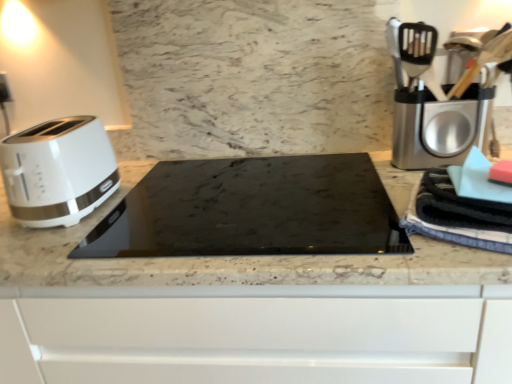
The width and height of the screenshot is (512, 384). Identify the location of black glass cooktop at center. (252, 210).

I want to click on blue striped towel at right, so click(x=462, y=207).

Which object is further away from the camera, blue striped towel at right or black glass cooktop at center?

Positioned behind is black glass cooktop at center.

Which is closer to the camera, [457,233] or [315,241]?

Point [457,233]

This screenshot has height=384, width=512. What are the coordinates of `blanket that is above the black glass cooktop at center (from the image's perspective)` in the screenshot? It's located at 462,207.

From the image's perspective, between blue striped towel at right and black glass cooktop at center, who is located below?

black glass cooktop at center is shown below in the image.

Is white glossy toaster at left behind marble at center?

Yes, it is.

Is point (106, 160) positioned before point (429, 355)?

No, (106, 160) is behind (429, 355).

Could you tell me if white glossy toaster at left is turned towards marble at center?

No, white glossy toaster at left does not turn towards marble at center.

Which of these two, white glossy toaster at left or marble at center, stands shorter?

white glossy toaster at left.

Considering the sizes of objects silver metallic coffee machine at right and marble at center in the image provided, who is thinner, silver metallic coffee machine at right or marble at center?

silver metallic coffee machine at right is thinner.

In the image, there is a marble at center. What are the coordinates of `coffee machine above it (from the image's perspective)` in the screenshot? It's located at (432, 105).

How distant is silver metallic coffee machine at right from marble at center?

The distance of silver metallic coffee machine at right from marble at center is 40.12 centimeters.

From the image's perspective, relative to marble at center, is silver metallic coffee machine at right above or below?

silver metallic coffee machine at right is above marble at center.

From a real-world perspective, is blue striped towel at right over silver metallic coffee machine at right?

No, from a real-world perspective, blue striped towel at right is not above silver metallic coffee machine at right.

From the image's perspective, between blue striped towel at right and silver metallic coffee machine at right, who is located below?

blue striped towel at right, from the image's perspective.

Considering the relative sizes of blue striped towel at right and silver metallic coffee machine at right in the image provided, is blue striped towel at right taller than silver metallic coffee machine at right?

Incorrect, the height of blue striped towel at right is not larger of that of silver metallic coffee machine at right.

Is point (496, 192) farther from viewer compared to point (430, 44)?

No, (496, 192) is closer to viewer.

Is there a large distance between silver metallic coffee machine at right and white glossy toaster at left?

That's not correct — silver metallic coffee machine at right is a little close to white glossy toaster at left.

Is point (443, 145) closer to camera compared to point (64, 139)?

No, it is not.

What are the coordinates of `toaster in front of the silver metallic coffee machine at right` in the screenshot? It's located at (58, 171).

Considering the sizes of objects silver metallic coffee machine at right and white glossy toaster at left in the image provided, who is wider, silver metallic coffee machine at right or white glossy toaster at left?

Wider between the two is white glossy toaster at left.

From the picture: Which of these two, marble at center or silver metallic coffee machine at right, is bigger?

Bigger between the two is marble at center.

From the image's perspective, which one is positioned higher, marble at center or silver metallic coffee machine at right?

silver metallic coffee machine at right is shown above in the image.

Relative to silver metallic coffee machine at right, is marble at center in front or behind?

Clearly, marble at center is in front of silver metallic coffee machine at right.

From a real-world perspective, is marble at center on silver metallic coffee machine at right?

No, from a real-world perspective, marble at center is not on top of silver metallic coffee machine at right.

Are blue striped towel at right and white glossy toaster at left making contact?

No, blue striped towel at right is not making contact with white glossy toaster at left.

From the image's perspective, is blue striped towel at right above white glossy toaster at left?

No, from the image's perspective, blue striped towel at right is not over white glossy toaster at left.

Who is taller, blue striped towel at right or white glossy toaster at left?

white glossy toaster at left is taller.

How distant is blue striped towel at right from white glossy toaster at left?

blue striped towel at right and white glossy toaster at left are 27.53 inches apart from each other.

Locate an element on the screen. Image resolution: width=512 pixels, height=384 pixels. blanket above the black glass cooktop at center (from a real-world perspective) is located at coordinates (462, 207).

This screenshot has width=512, height=384. Find the location of `toaster located on the left of marble at center`. toaster located on the left of marble at center is located at coordinates (58, 171).

Which object lies further to the anchor point silver metallic coffee machine at right, blue striped towel at right or white glossy toaster at left?

white glossy toaster at left is further to silver metallic coffee machine at right.

When comparing their distances from silver metallic coffee machine at right, does white glossy toaster at left or marble at center seem closer?

marble at center.

When comparing their distances from marble at center, does silver metallic coffee machine at right or black glass cooktop at center seem further?

Among the two, silver metallic coffee machine at right is located further to marble at center.

From the image, which object appears to be nearer to silver metallic coffee machine at right, marble at center or white glossy toaster at left?

Result: marble at center.

From the image, which object appears to be farther from white glossy toaster at left, black glass cooktop at center or marble at center?

marble at center is further to white glossy toaster at left.

From the picture: When comparing their distances from blue striped towel at right, does marble at center or silver metallic coffee machine at right seem further?

marble at center.

When comparing their distances from white glossy toaster at left, does marble at center or black glass cooktop at center seem closer?

black glass cooktop at center lies closer to white glossy toaster at left than the other object.

Estimate the real-world distances between objects in this image. Which object is closer to white glossy toaster at left, silver metallic coffee machine at right or black glass cooktop at center?

Based on the image, black glass cooktop at center appears to be nearer to white glossy toaster at left.

Locate an element on the screen. This screenshot has width=512, height=384. home appliance between white glossy toaster at left and marble at center from top to bottom is located at coordinates (252, 210).

Locate an element on the screen. This screenshot has height=384, width=512. countertop situated between white glossy toaster at left and silver metallic coffee machine at right from left to right is located at coordinates (247, 289).

I want to click on home appliance between white glossy toaster at left and silver metallic coffee machine at right in the horizontal direction, so click(252, 210).

Image resolution: width=512 pixels, height=384 pixels. In order to click on home appliance situated between marble at center and blue striped towel at right from left to right in this screenshot , I will do `click(252, 210)`.